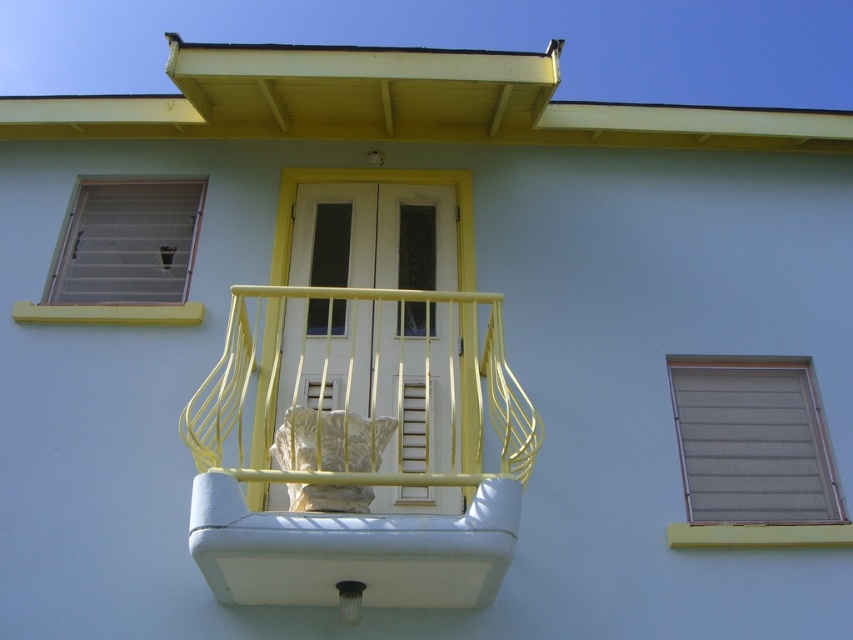
You are standing on the balcony looking out. There are two points marked on the balcony floor. The first point is at coordinate point [726,396] and the second at point [131,292]. Which point is closer to you as you face the balcony railing?

Point [726,396] is in front of point [131,292], so it is closer to you as you face the balcony railing.

You are a painter standing on the balcony. You need to paint the yellow painted wood at lower right and the matte gray shutters at upper left. Which object should you paint first if you want to avoid getting paint on the other one?

You should paint the matte gray shutters at upper left first because the yellow painted wood at lower right is behind it. Painting the front object first prevents paint from dripping onto the one behind.